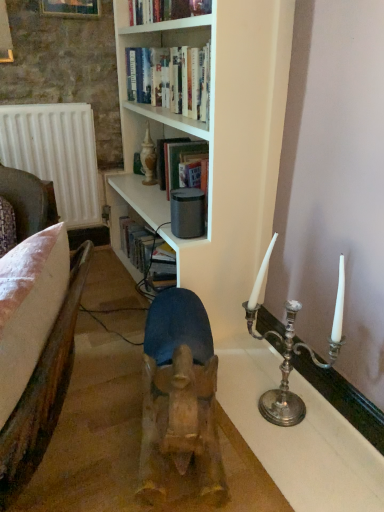
Image resolution: width=384 pixels, height=512 pixels. Find the location of `vacant space positioned to the left of silver metallic candle holder at right`. vacant space positioned to the left of silver metallic candle holder at right is located at coordinates (232, 410).